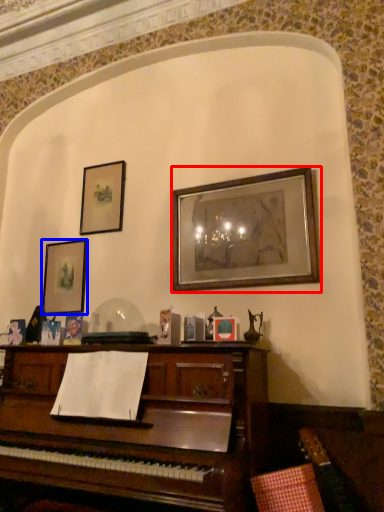
Question: Which of the following is the closest to the observer, picture frame (highlighted by a red box) or picture frame (highlighted by a blue box)?

Choices:
 (A) picture frame
 (B) picture frame

Answer: (A)